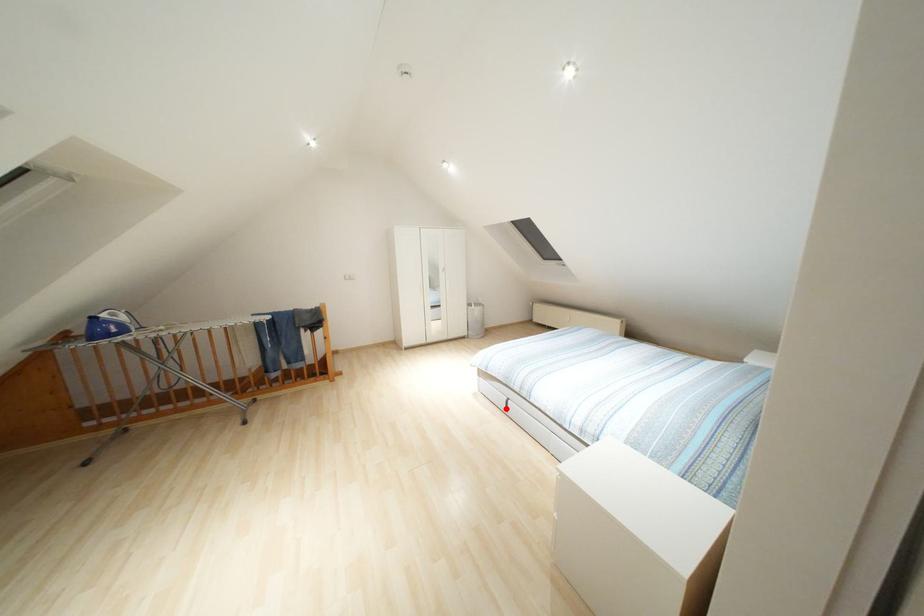
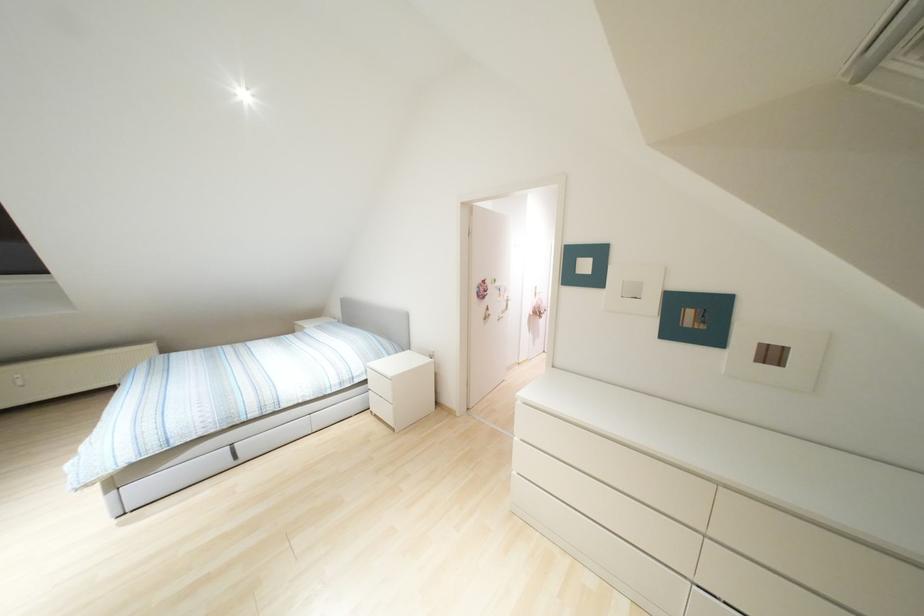
Locate, in the second image, the point that corresponds to the highlighted location in the first image.

(235, 456)